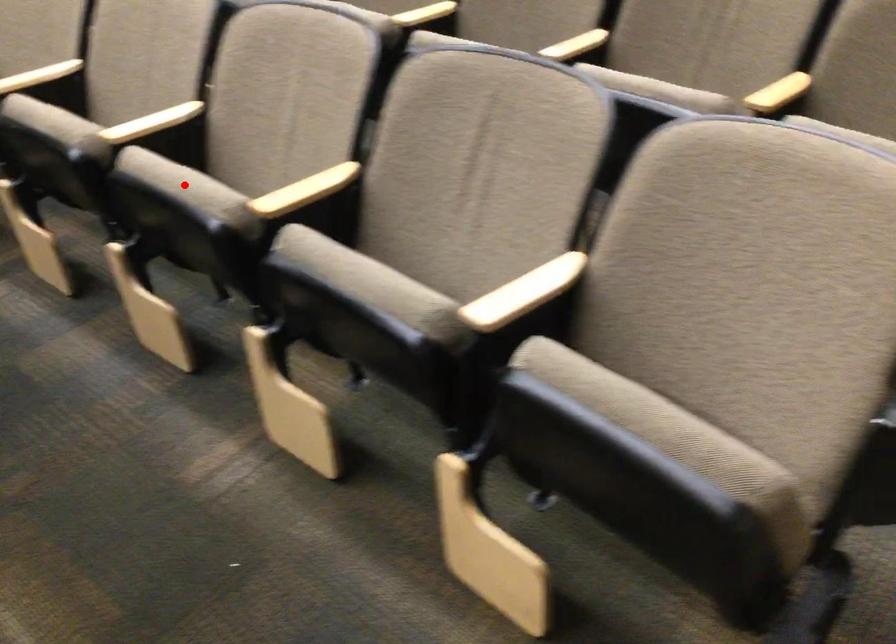
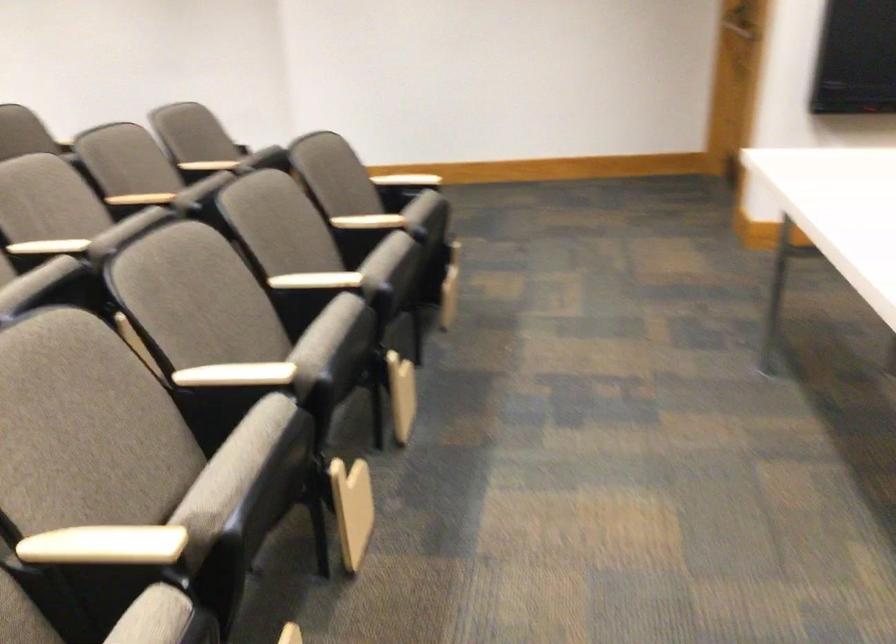
Question: I am providing you with two images of the same scene from different viewpoints. A red point is marked on the first image. At the location where the point appears in image 1, is it still visible in image 2?

Choices:
 (A) Yes
 (B) No

Answer: (B)